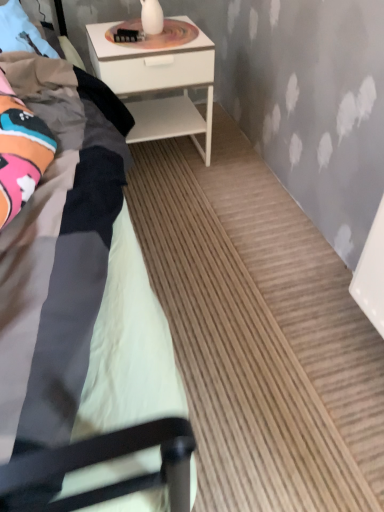
What do you see at coordinates (158, 85) in the screenshot?
I see `white glossy nightstand at upper center` at bounding box center [158, 85].

Find the location of a particular element. This screenshot has width=384, height=512. white glossy nightstand at upper center is located at coordinates (158, 85).

Find the location of a particular element. Image resolution: width=384 pixels, height=512 pixels. white glossy nightstand at upper center is located at coordinates (158, 85).